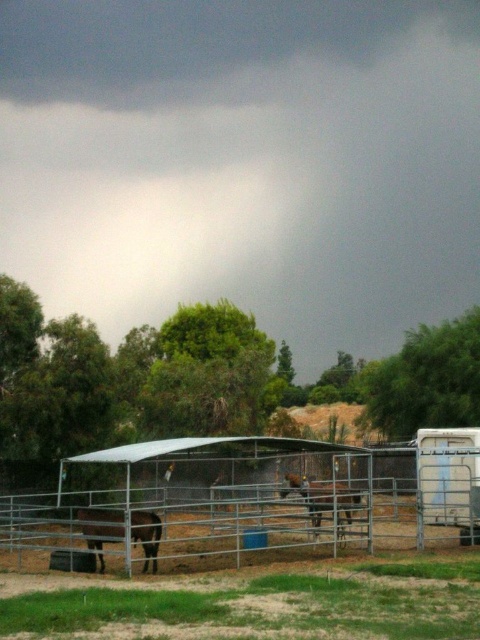
You are standing at the origin point in the image. You see two points, point (x=71, y=552) and point (x=340, y=504). Which point is closer to you?

Point (x=71, y=552) is in front of point (x=340, y=504), so it is closer to you.